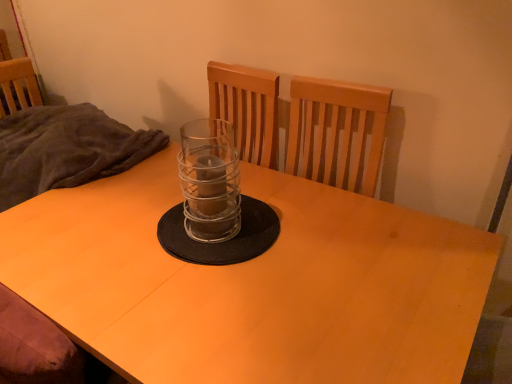
Identify the location of free space on the front side of clear glass candle holder at center. (203, 281).